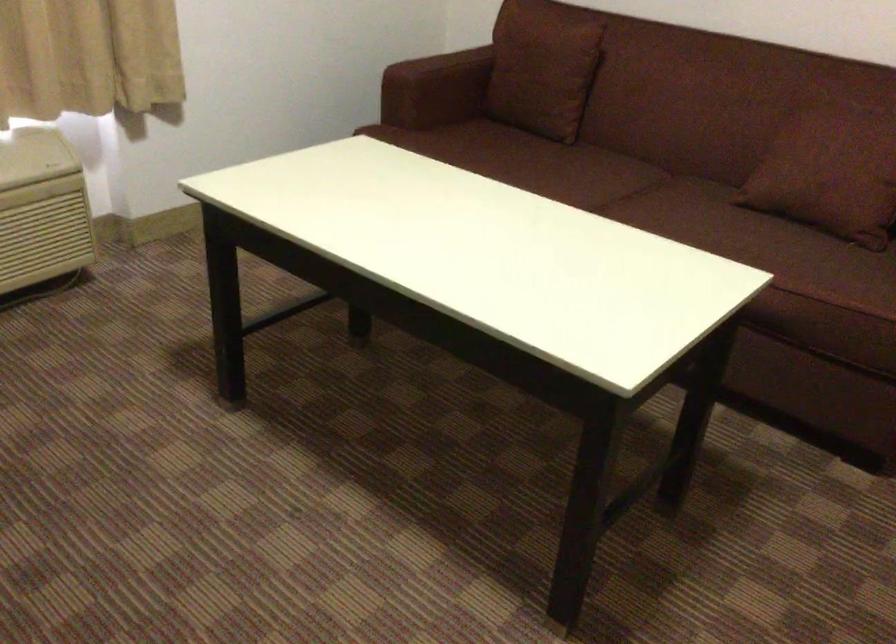
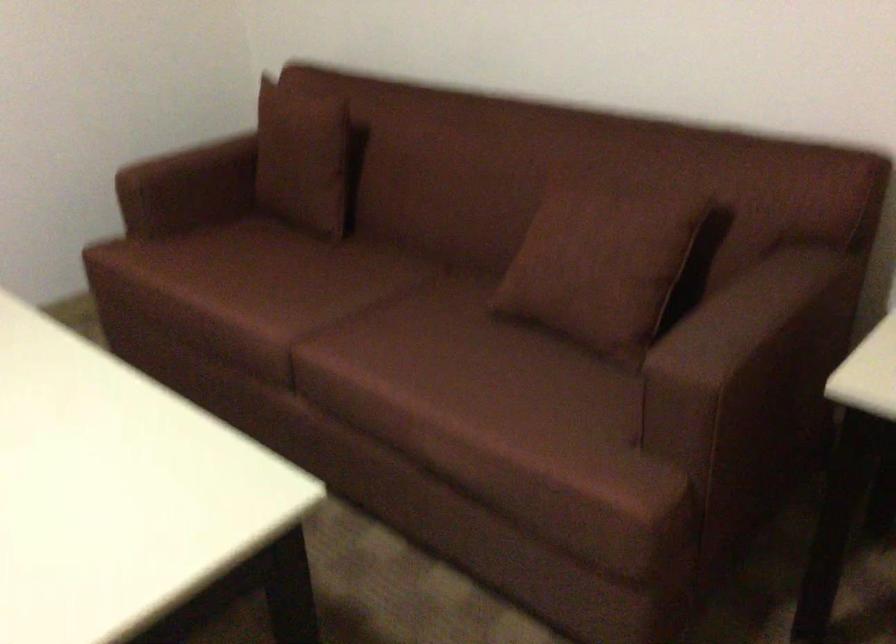
Find the pixel in the second image that matches the point at 481,73 in the first image.

(246, 165)